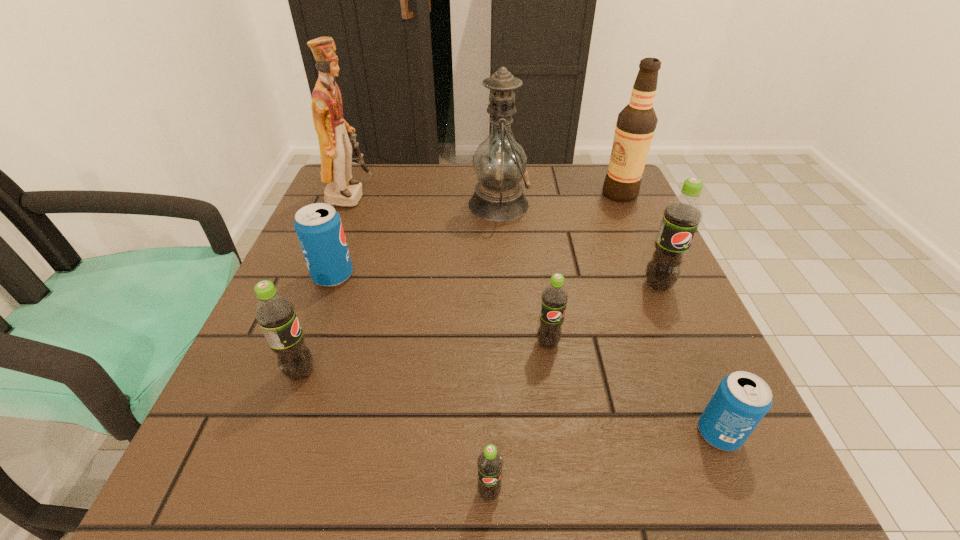
Choose which object is the second nearest neighbor to the beige alcohol. Please provide its 2D coordinates. Your answer should be formatted as a tuple, i.e. [(x, y)], where the tuple contains the x and y coordinates of a point satisfying the conditions above.

[(682, 215)]

This screenshot has height=540, width=960. Identify the location of object that is the fifth closest to the nearer blue soda can. (636, 123).

Image resolution: width=960 pixels, height=540 pixels. What are the coordinates of `the fifth closest soda to the biggest green soda` in the screenshot? It's located at (275, 314).

The width and height of the screenshot is (960, 540). What are the coordinates of `the third closest soda relative to the alcohol` in the screenshot? It's located at (742, 399).

Select which green soda appears as the closest to the oil lamp. Please provide its 2D coordinates. Your answer should be formatted as a tuple, i.e. [(x, y)], where the tuple contains the x and y coordinates of a point satisfying the conditions above.

[(682, 215)]

Locate which green soda is the second closest to the fourth nearest soda. Please provide its 2D coordinates. Your answer should be formatted as a tuple, i.e. [(x, y)], where the tuple contains the x and y coordinates of a point satisfying the conditions above.

[(489, 462)]